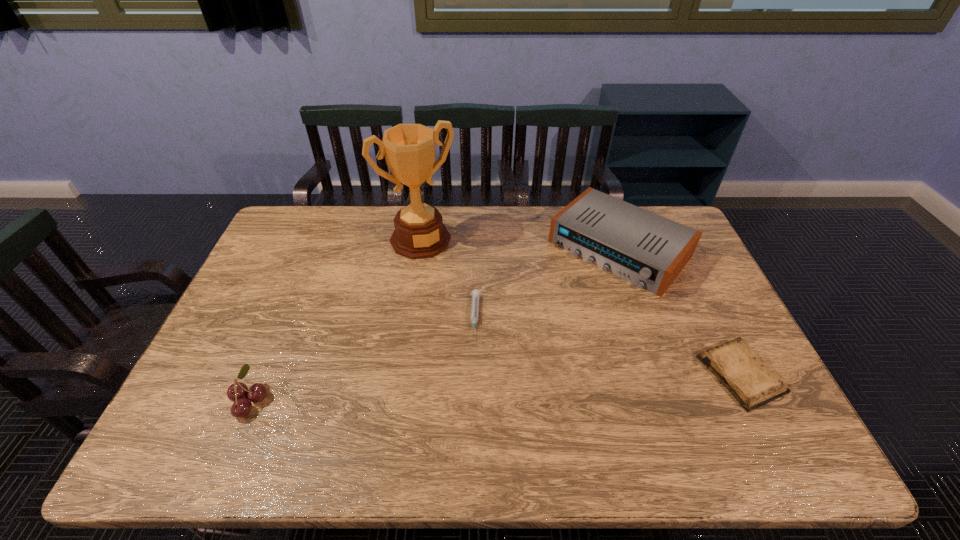
Locate an element on the screen. free space at the left edge is located at coordinates (257, 378).

Image resolution: width=960 pixels, height=540 pixels. I want to click on free spot between the cherry and the radio receiver, so click(434, 325).

Where is `free spot between the radio receiver and the second object from left to right`? The height and width of the screenshot is (540, 960). free spot between the radio receiver and the second object from left to right is located at coordinates (519, 244).

The width and height of the screenshot is (960, 540). What are the coordinates of `free spot between the cherry and the radio receiver` in the screenshot? It's located at (434, 325).

Locate an element on the screen. The width and height of the screenshot is (960, 540). vacant region between the leftmost object and the radio receiver is located at coordinates (434, 325).

The image size is (960, 540). What are the coordinates of `free space between the second shortest object and the radio receiver` in the screenshot? It's located at [x=680, y=312].

Image resolution: width=960 pixels, height=540 pixels. What are the coordinates of `vacant space in between the leftmost object and the shortest object` in the screenshot? It's located at (363, 359).

What are the coordinates of `free spot between the cherry and the second object from left to right` in the screenshot? It's located at (335, 320).

Where is `vacant space that's between the award and the cherry`? The height and width of the screenshot is (540, 960). vacant space that's between the award and the cherry is located at coordinates (335, 320).

At what (x,y) coordinates should I click in order to perform the action: click on vacant region between the second object from left to right and the radio receiver. Please return your answer as a coordinate pair (x, y). This screenshot has height=540, width=960. Looking at the image, I should click on (519, 244).